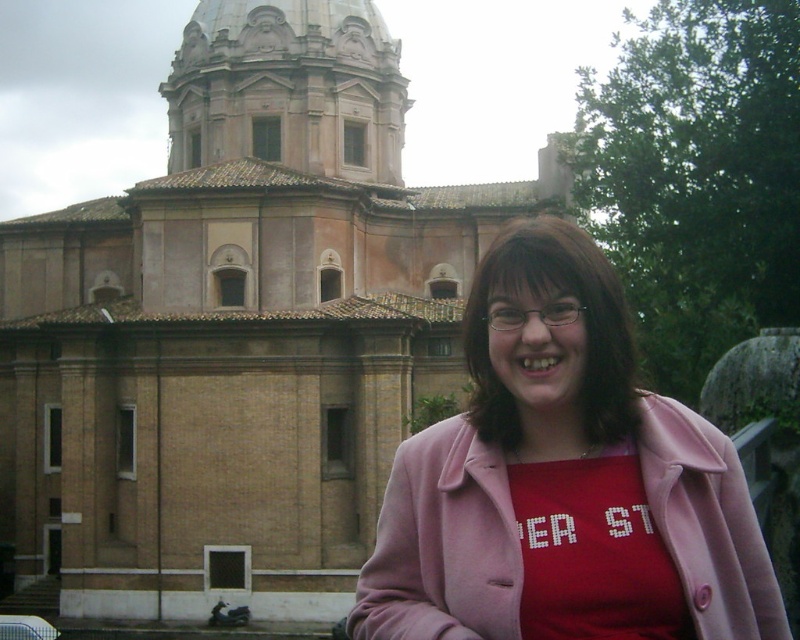
Can you confirm if beige stone church at center is positioned above pink fabric at center?

Indeed, beige stone church at center is positioned over pink fabric at center.

Is point (333, 168) farther from camera compared to point (454, 472)?

That is True.

Where is `beige stone church at center`? This screenshot has width=800, height=640. beige stone church at center is located at coordinates (237, 328).